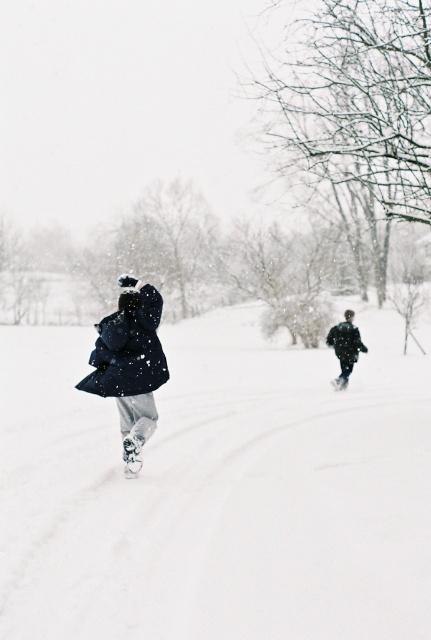
Who is positioned more to the left, white fluffy snow at center or matte black coat at left?

white fluffy snow at center

Between white fluffy snow at center and matte black coat at left, which one has less height?

With less height is matte black coat at left.

The image size is (431, 640). What do you see at coordinates (218, 490) in the screenshot?
I see `white fluffy snow at center` at bounding box center [218, 490].

In order to click on white fluffy snow at center in this screenshot , I will do `click(218, 490)`.

Is matte black coat at left to the left of dark matte coat at center from the viewer's perspective?

Indeed, matte black coat at left is positioned on the left side of dark matte coat at center.

The height and width of the screenshot is (640, 431). In order to click on matte black coat at left in this screenshot , I will do `click(130, 364)`.

Can you confirm if white fluffy snow at center is taller than dark matte coat at center?

Yes, white fluffy snow at center is taller than dark matte coat at center.

Find the location of a particular element. The width and height of the screenshot is (431, 640). white fluffy snow at center is located at coordinates (218, 490).